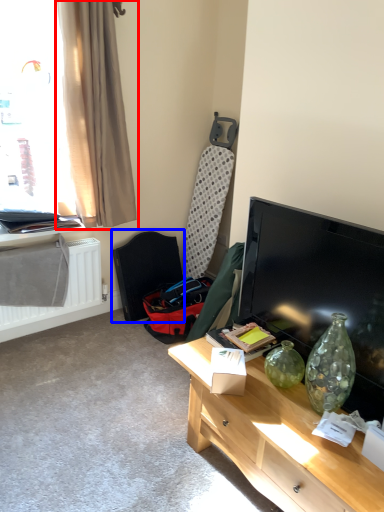
Question: Which object appears closest to the camera in this image, curtain (highlighted by a red box) or swivel chair (highlighted by a blue box)?

Choices:
 (A) curtain
 (B) swivel chair

Answer: (A)